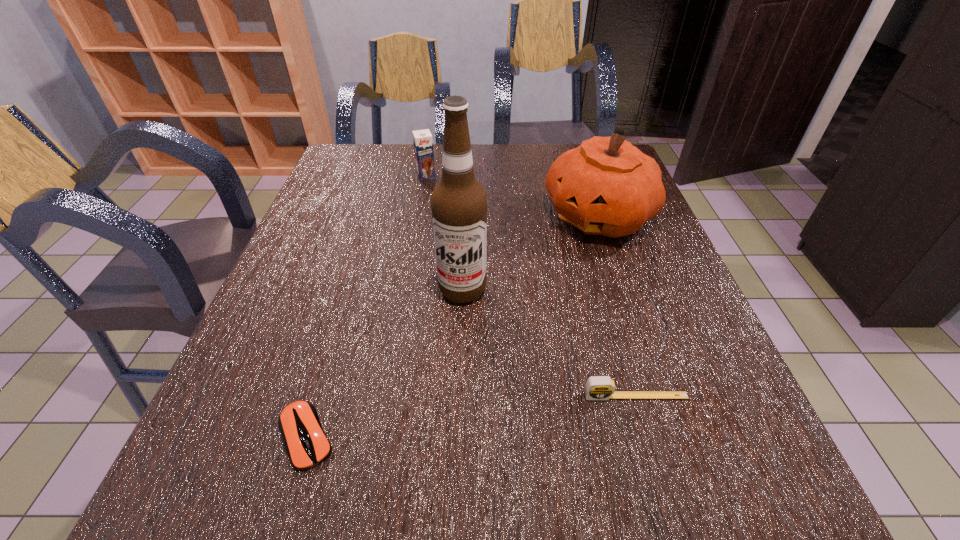
Locate an element on the screen. free space between the nearest object and the fourth farthest object is located at coordinates (471, 416).

At what (x,y) coordinates should I click in order to perform the action: click on unoccupied position between the tape measure and the fourth shortest object. Please return your answer as a coordinate pair (x, y). This screenshot has height=540, width=960. Looking at the image, I should click on (617, 306).

Find the location of a particular element. object that is the second nearest to the third nearest object is located at coordinates (597, 387).

Select which object is the fourth closest to the shortest object. Please provide its 2D coordinates. Your answer should be formatted as a tuple, i.e. [(x, y)], where the tuple contains the x and y coordinates of a point satisfying the conditions above.

[(423, 143)]

At what (x,y) coordinates should I click in order to perform the action: click on free space that satisfies the following two spatial constraints: 1. on the back side of the pumpkin; 2. on the left side of the nearest object. Please return your answer as a coordinate pair (x, y). This screenshot has width=960, height=540. Looking at the image, I should click on (373, 217).